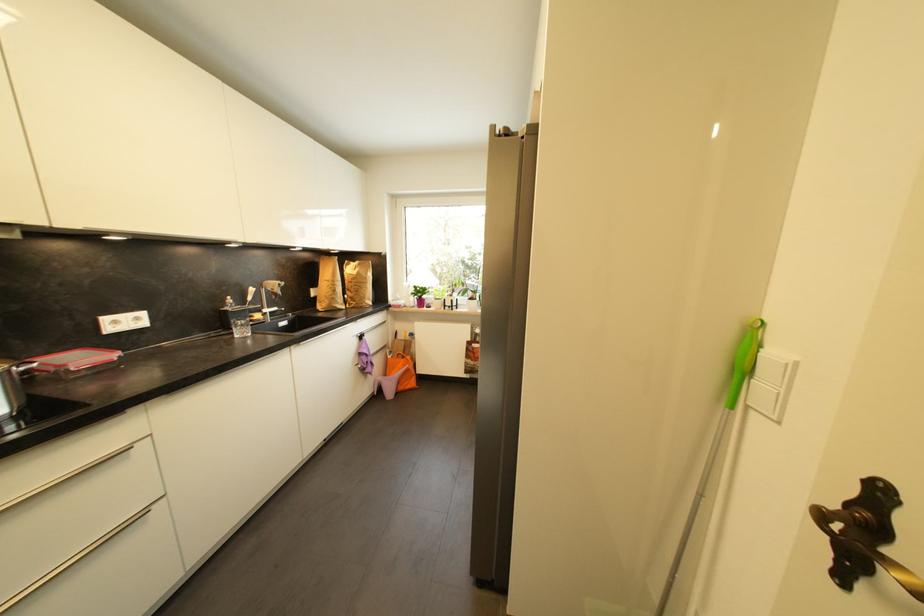
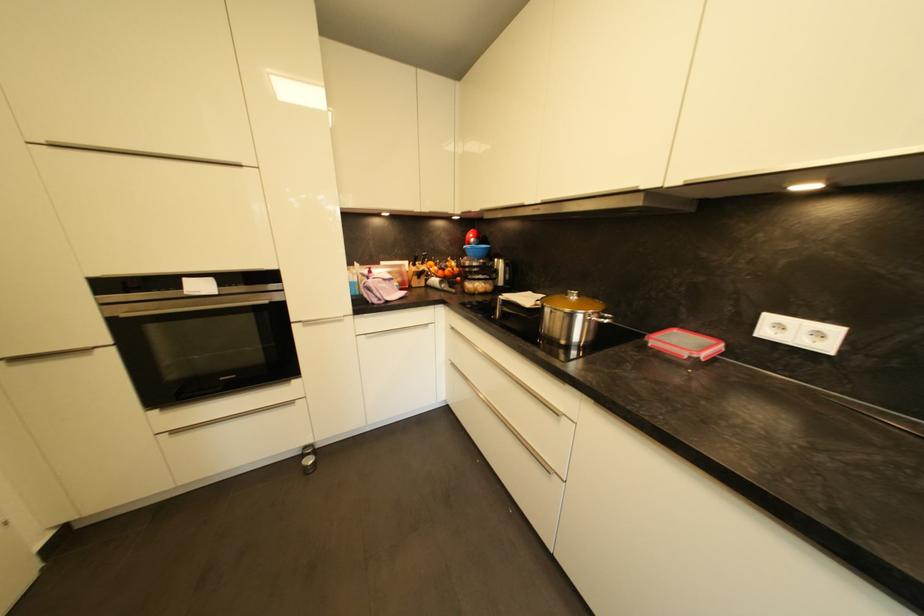
Find the pixel in the second image that matches (x=84, y=361) in the first image.

(686, 345)